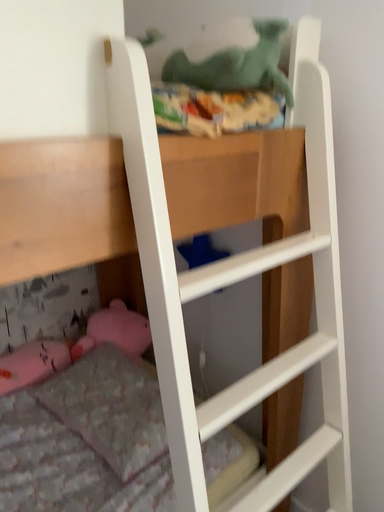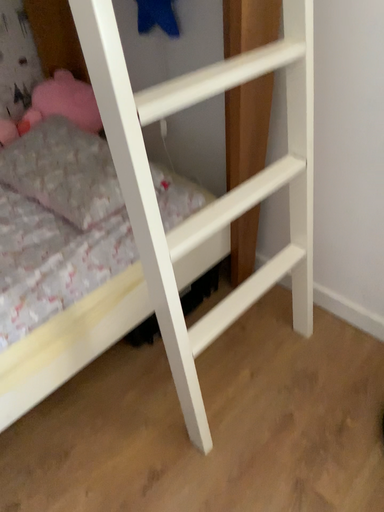
Question: How did the camera likely rotate when shooting the video?

Choices:
 (A) rotated upward
 (B) rotated downward

Answer: (B)